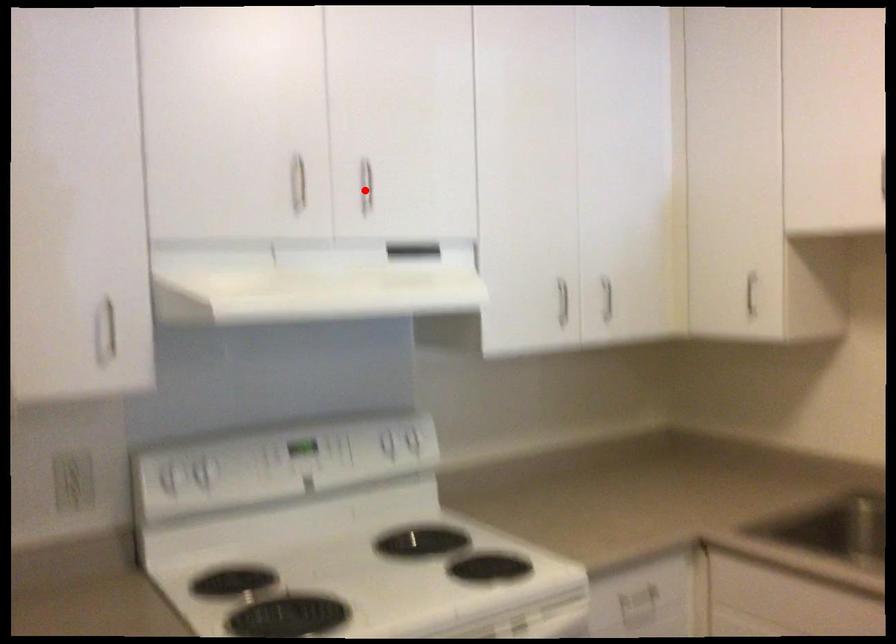
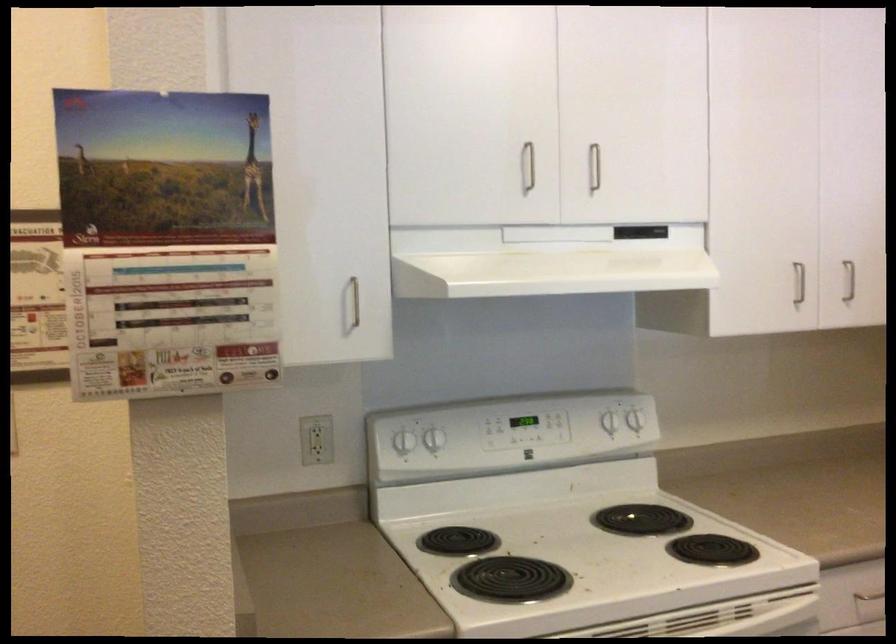
In the second image, find the point that corresponds to the highlighted location in the first image.

(593, 167)